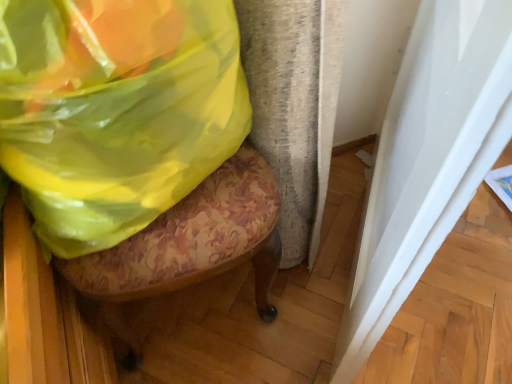
You are a GUI agent. You are given a task and a screenshot of the screen. Output one action in this format:
    pyautogui.click(x=<x>, y=<y>)
    Task: Click on the translucent yellow plastic bag at lower left
    The width and height of the screenshot is (512, 384).
    Given the screenshot: What is the action you would take?
    pyautogui.click(x=116, y=111)

Describe the element at coordinates (116, 111) in the screenshot. I see `translucent yellow plastic bag at lower left` at that location.

Where is `translucent yellow plastic bag at lower left`? translucent yellow plastic bag at lower left is located at coordinates (116, 111).